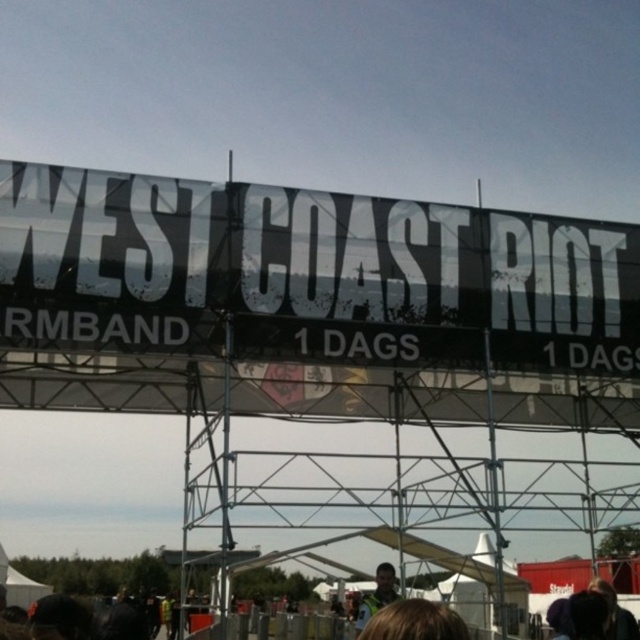
You are a photographer at the event and want to capture both the blonde hair at lower center and the green fabric jacket at center in a single photo. Given their sizes, which object should you focus on to ensure both are clearly visible?

Since the blonde hair at lower center is smaller in size compared to the green fabric jacket at center, you should focus on the green fabric jacket at center to ensure both are clearly visible in the photo.